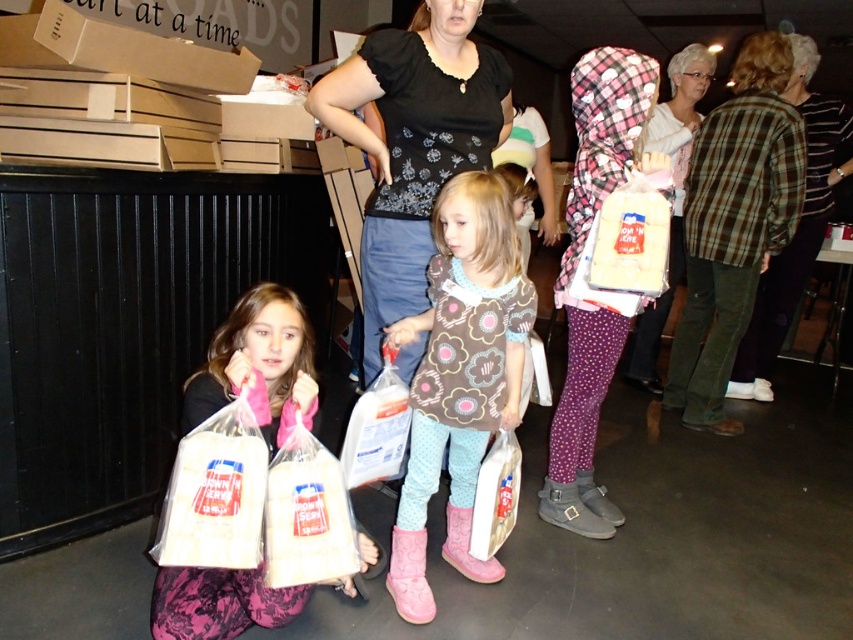
In the scene shown: You are a photographer taking a picture of the fluffy pink boots at center and the white plastic bag at center. Which object should you focus on first if you want to capture both in sharp detail?

The fluffy pink boots at center is larger in size than the white plastic bag at center, so you should focus on the fluffy pink boots at center first to ensure both are in sharp detail.